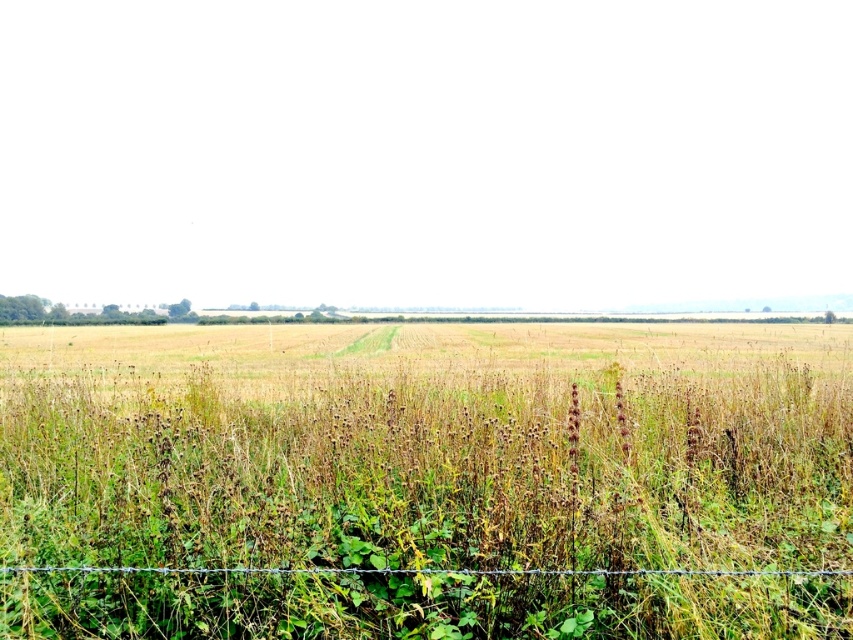
Question: Which of the following is the closest to the observer?

Choices:
 (A) (267, 426)
 (B) (711, 570)

Answer: (B)

Question: Which object is closer to the camera taking this photo?

Choices:
 (A) green grass at center
 (B) wire at bottom

Answer: (A)

Question: Which of the following is the closest to the observer?

Choices:
 (A) (364, 410)
 (B) (56, 564)

Answer: (B)

Question: From the image, what is the correct spatial relationship of green grass at center in relation to wire at bottom?

Choices:
 (A) right
 (B) left

Answer: (A)

Question: Does green grass at center come in front of wire at bottom?

Choices:
 (A) no
 (B) yes

Answer: (B)

Question: Is green grass at center positioned at the back of wire at bottom?

Choices:
 (A) no
 (B) yes

Answer: (A)